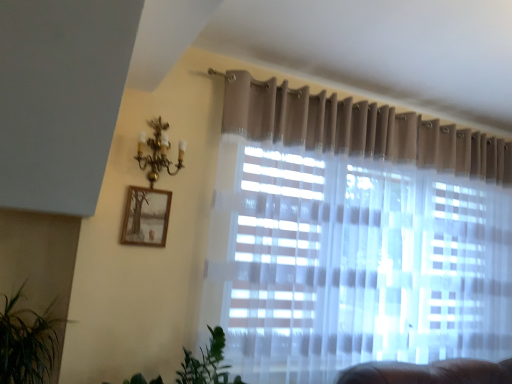
The width and height of the screenshot is (512, 384). What do you see at coordinates (146, 217) in the screenshot? I see `wooden frame at upper left` at bounding box center [146, 217].

This screenshot has height=384, width=512. Identify the location of wooden frame at upper left. (146, 217).

At what (x,y) coordinates should I click in order to perform the action: click on wooden frame at upper left. Please return your answer as a coordinate pair (x, y). Looking at the image, I should click on (146, 217).